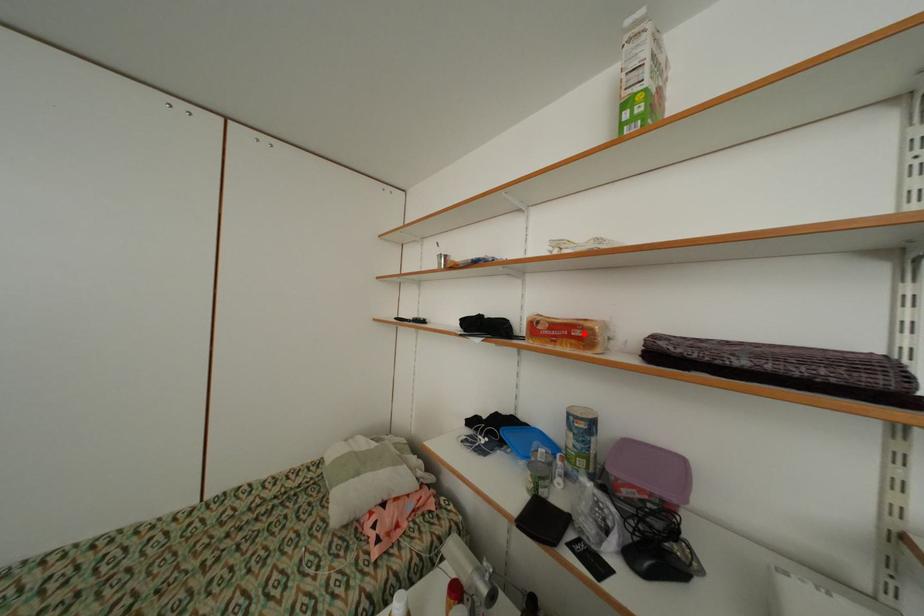
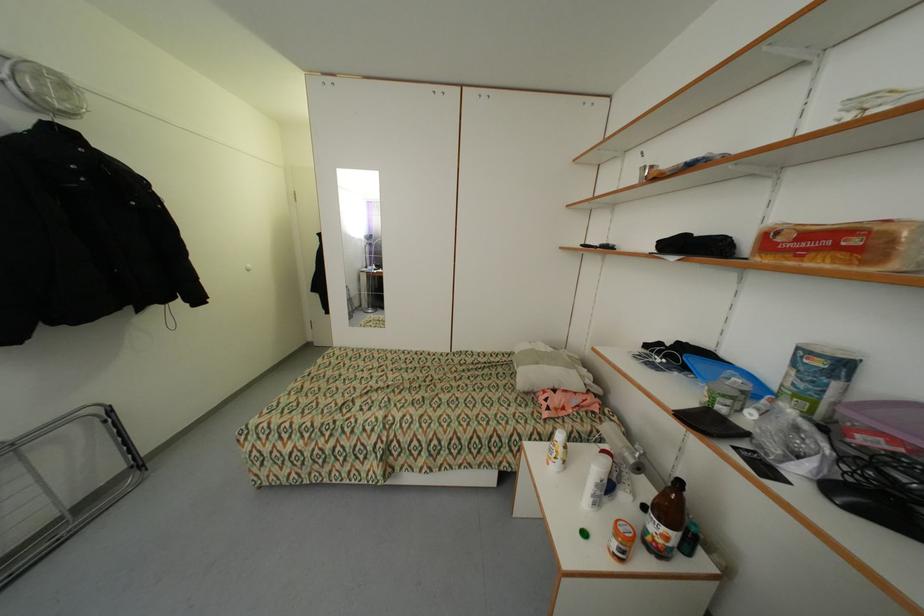
The point at the highlighted location is marked in the first image. Where is the corresponding point in the second image?

(860, 241)